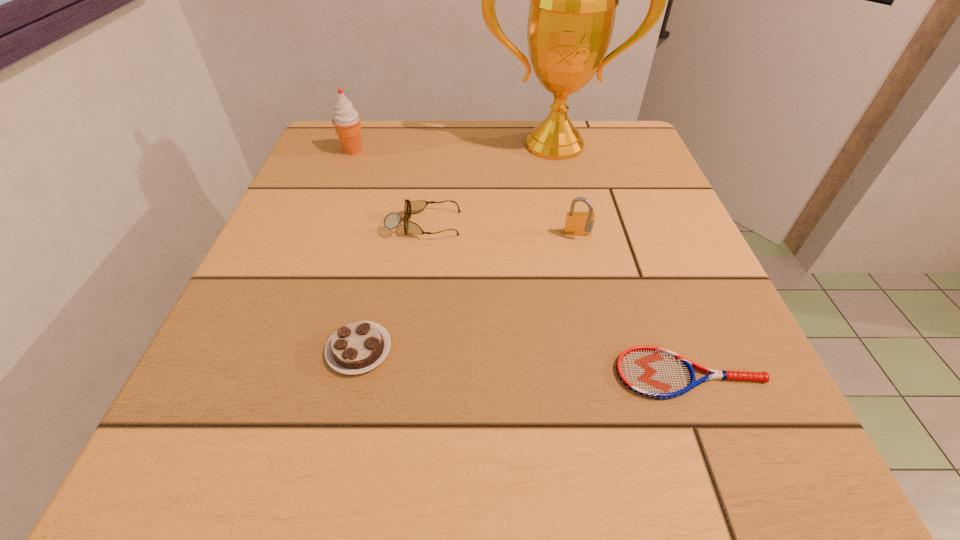
Identify the location of award. This screenshot has height=540, width=960. (573, 0).

At what (x,y) coordinates should I click in order to perform the action: click on the fifth shortest object. Please return your answer as a coordinate pair (x, y). The image size is (960, 540). Looking at the image, I should click on (346, 120).

Where is `the leftmost object`? This screenshot has height=540, width=960. the leftmost object is located at coordinates (346, 120).

This screenshot has width=960, height=540. Find the location of `the fourth shortest object`. the fourth shortest object is located at coordinates (580, 223).

At what (x,y) coordinates should I click in order to perform the action: click on spectacles. Please return your answer as a coordinate pair (x, y). The image size is (960, 540). Looking at the image, I should click on (392, 220).

The image size is (960, 540). In order to click on the fifth tallest object in this screenshot , I will do `click(357, 347)`.

Identify the location of tennis racket. Image resolution: width=960 pixels, height=540 pixels. (650, 371).

At what (x,y) coordinates should I click in order to perform the action: click on free space located on the front-facing side of the tallest object. Please return your answer as a coordinate pair (x, y). The width and height of the screenshot is (960, 540). Looking at the image, I should click on (570, 215).

The height and width of the screenshot is (540, 960). In order to click on free space located 0.200m on the right of the leftmost object in this screenshot , I will do `click(459, 150)`.

Find the location of a particular element. The width and height of the screenshot is (960, 540). vacant space located on the side with the combination dials of the third tallest object is located at coordinates (618, 403).